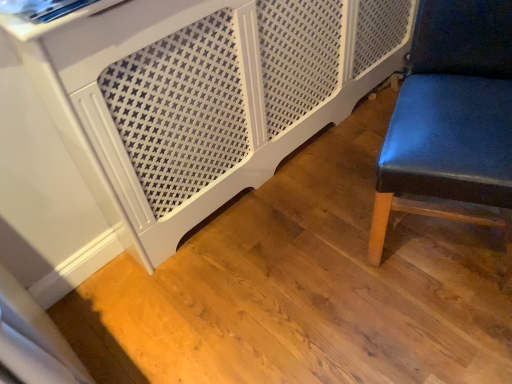
The height and width of the screenshot is (384, 512). Find the location of `blank area to the left of blue leather chair at right`. blank area to the left of blue leather chair at right is located at coordinates (316, 244).